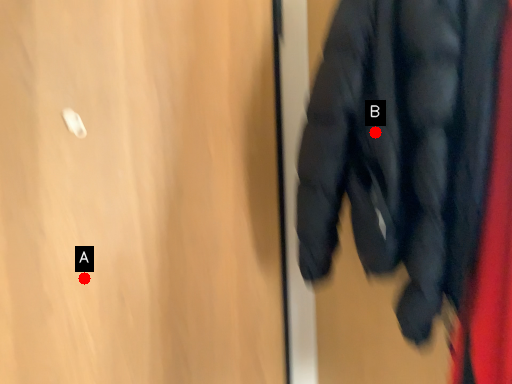
Question: Two points are circled on the image, labeled by A and B beside each circle. Which point is further to the camera?

Choices:
 (A) A is further
 (B) B is further

Answer: (A)